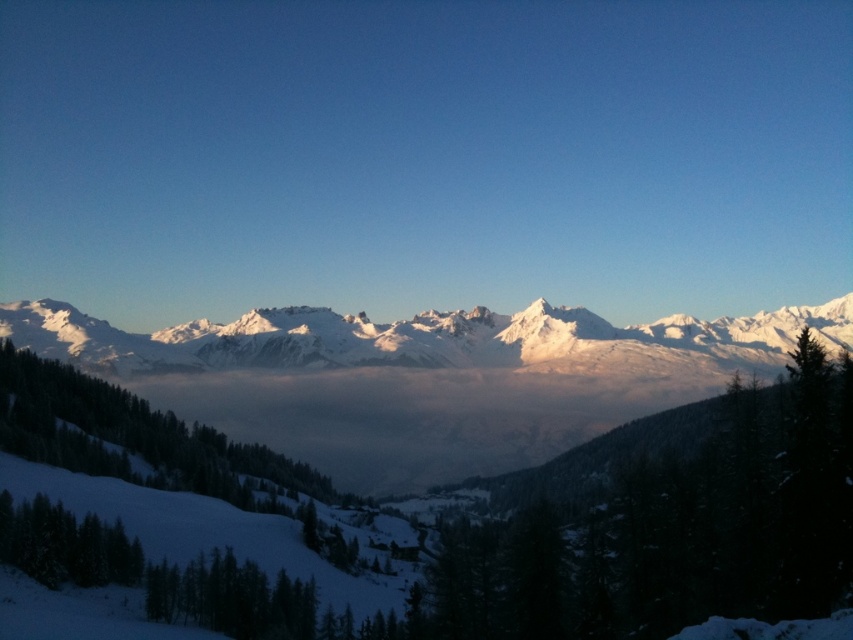
Which is below, white snow-covered mountain range at center or white snow-covered mountains at center?

Answer: white snow-covered mountain range at center is lower down.

Identify the location of white snow-covered mountain range at center. The image size is (853, 640). (422, 378).

At what (x,y) coordinates should I click in order to perform the action: click on white snow-covered mountain range at center. Please return your answer as a coordinate pair (x, y). This screenshot has height=640, width=853. Looking at the image, I should click on (422, 378).